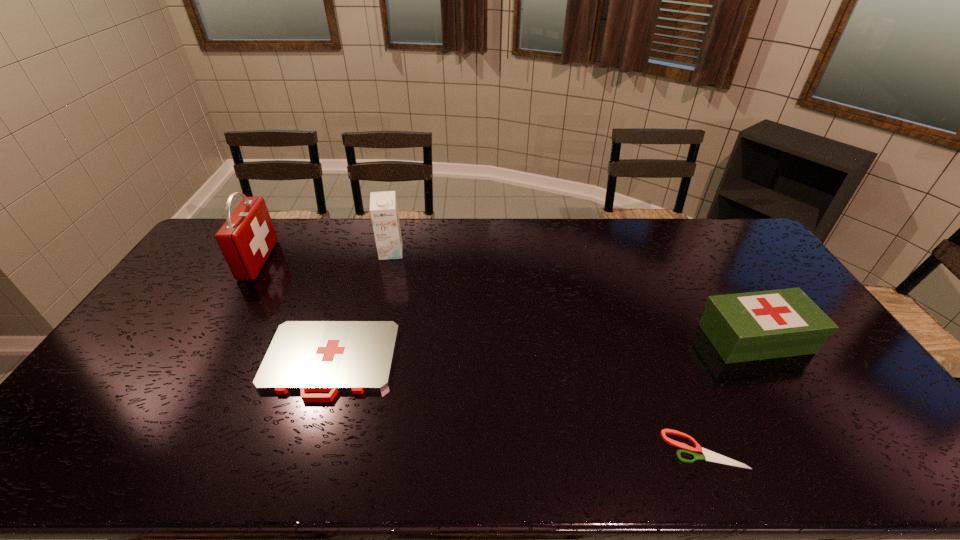
Locate an element on the screen. This screenshot has width=960, height=540. the leftmost first-aid kit is located at coordinates (246, 239).

Identify the location of the farthest first-aid kit. The height and width of the screenshot is (540, 960). (246, 239).

This screenshot has width=960, height=540. I want to click on carton, so click(383, 205).

Identify the location of the rightmost first-aid kit. The image size is (960, 540). (760, 325).

This screenshot has height=540, width=960. Identify the location of the rightmost object. (760, 325).

This screenshot has height=540, width=960. I want to click on the second first-aid kit from right to left, so (x=304, y=356).

The image size is (960, 540). I want to click on the shortest first-aid kit, so click(304, 356).

At what (x,y) coordinates should I click in order to perform the action: click on the fourth object from left to right. Please return your answer as a coordinate pair (x, y). Looking at the image, I should click on (708, 455).

Locate an element on the screen. scissors is located at coordinates (708, 455).

Locate an element on the screen. This screenshot has height=540, width=960. free space located 0.350m on the front face of the tallest first-aid kit is located at coordinates (366, 260).